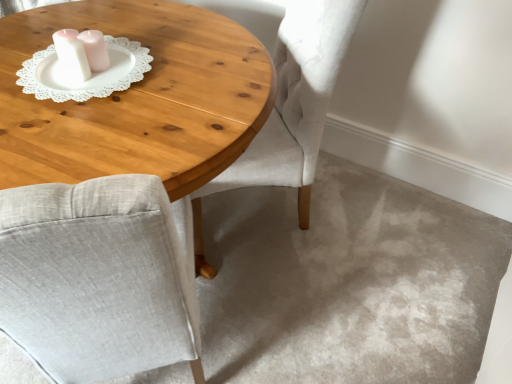
Find the location of `vacant area on the back side of white lace doily at upper left`. vacant area on the back side of white lace doily at upper left is located at coordinates (123, 37).